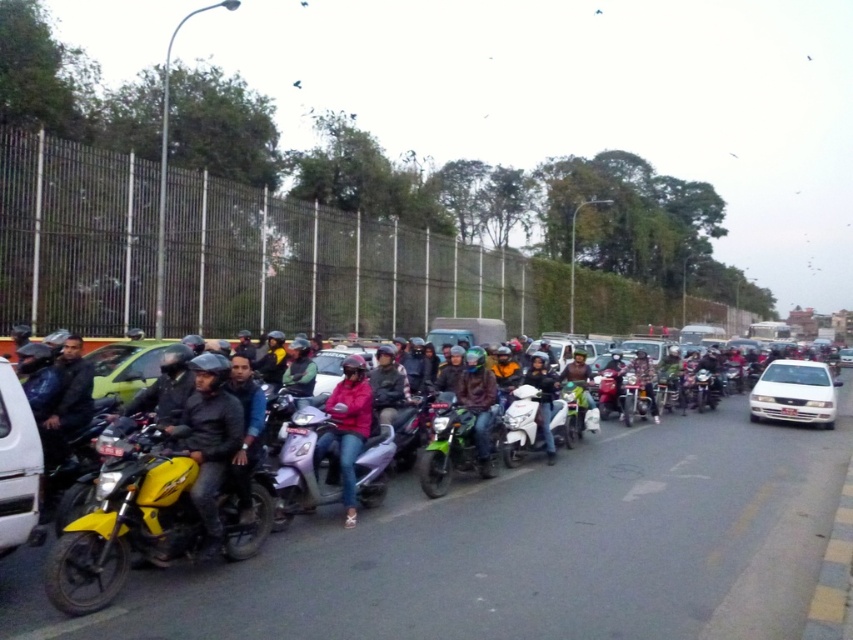
You are a pedestrian standing at point (347,428) on the busy street scene. What object is located exactly at your current position?

The pink matte jacket at center is located exactly at point (347,428).